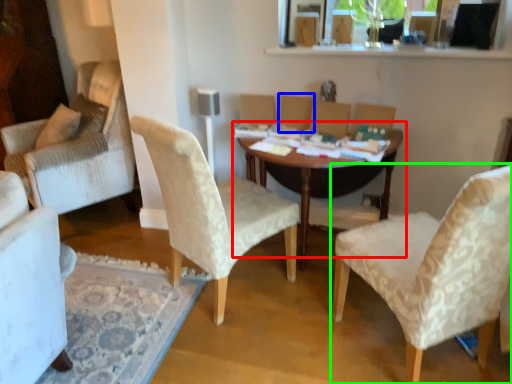
Question: Which object is positioned farthest from table (highlighted by a red box)? Select from armchair (highlighted by a blue box) and chair (highlighted by a green box).

Choices:
 (A) armchair
 (B) chair

Answer: (B)